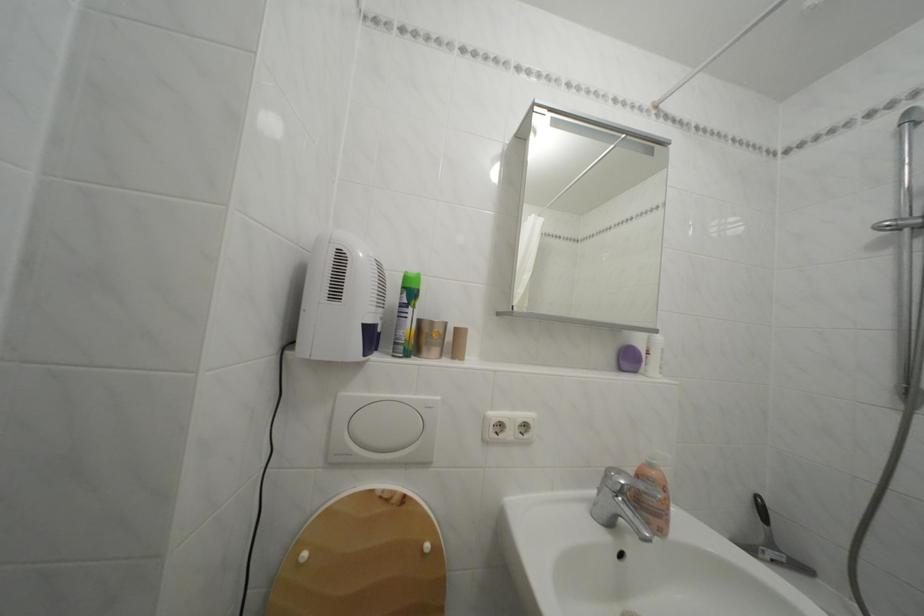
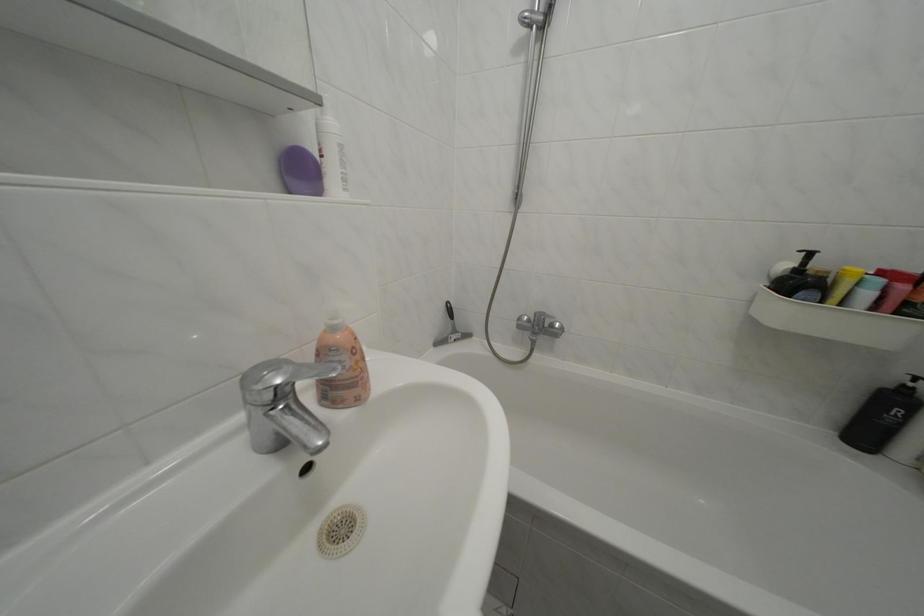
In the second image, find the point that corresponds to point 660,472 in the first image.

(342, 334)